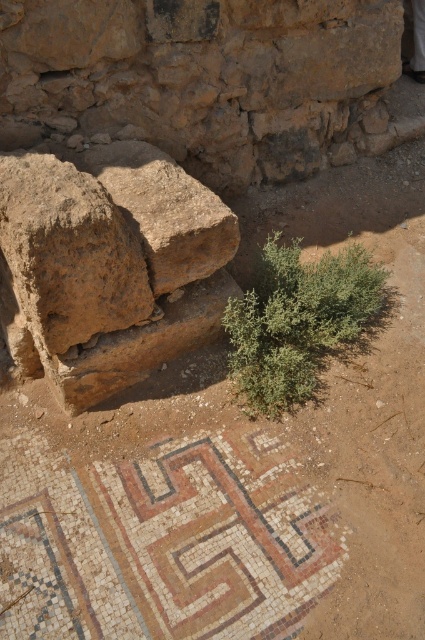
You are an archaeologist standing at the center of the site. You need to locate the brown rough rock at left. Where should you look relative to your position?

The brown rough rock at left is located at coordinates point (68, 252), so you should look to your left side, slightly forward from your current position at the center of the site.